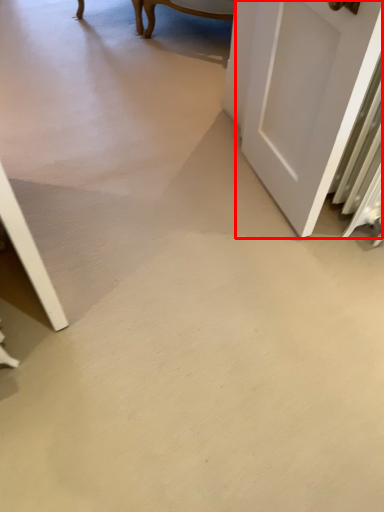
Question: From the image, what is the correct spatial relationship of door (annotated by the red box) in relation to concrete?

Choices:
 (A) right
 (B) left

Answer: (A)